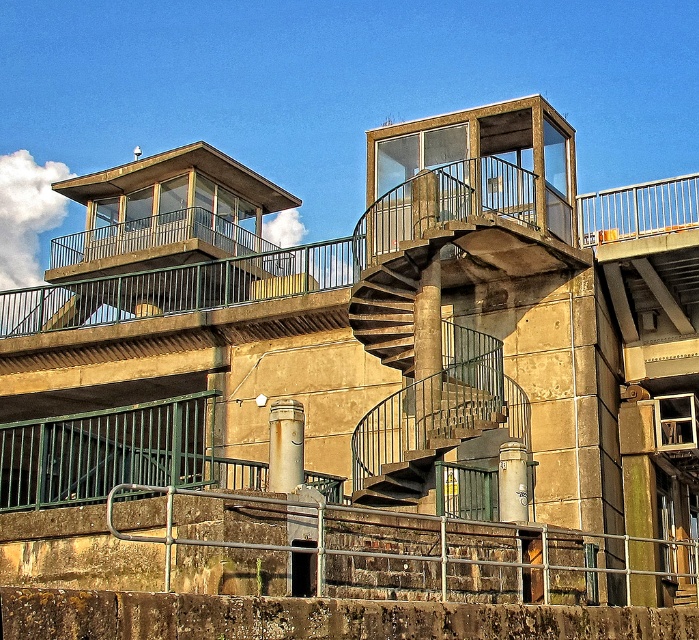
Question: Estimate the real-world distances between objects in this image. Which object is farther from the dark brown metal stairs at center?

Choices:
 (A) rusty metal pipe at center
 (B) metallic gray cylinder at lower center
 (C) rusty metal railing at lower center

Answer: (C)

Question: Which of the following is the closest to the observer?

Choices:
 (A) pos(387,572)
 (B) pos(403,492)
 (C) pos(296,426)
 (D) pos(505,465)

Answer: (A)

Question: Is dark brown metal stairs at center thinner than metallic gray cylinder at lower center?

Choices:
 (A) no
 (B) yes

Answer: (A)

Question: Based on their relative distances, which object is nearer to the metallic gray cylinder at lower center?

Choices:
 (A) rusty metal railing at lower center
 (B) rusty metal pipe at center

Answer: (A)

Question: Does rusty metal railing at lower center appear on the right side of rusty metal pipe at center?

Choices:
 (A) yes
 (B) no

Answer: (A)

Question: Does dark brown metal stairs at center appear under rusty metal pipe at center?

Choices:
 (A) yes
 (B) no

Answer: (A)